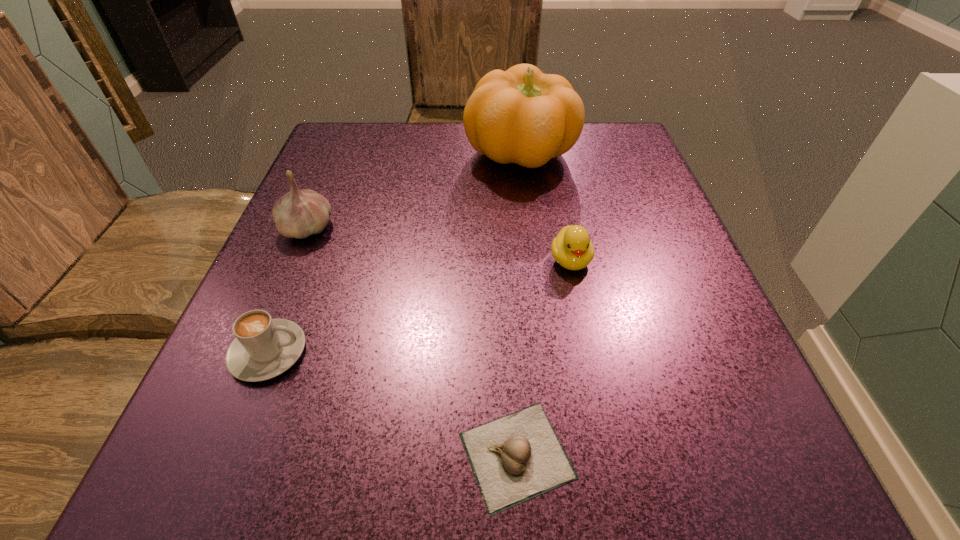
Image resolution: width=960 pixels, height=540 pixels. In order to click on empty space between the duckling and the right garlic in this screenshot , I will do `click(543, 357)`.

Where is `vacant area that lies between the farthest object and the second tallest object`? The width and height of the screenshot is (960, 540). vacant area that lies between the farthest object and the second tallest object is located at coordinates (414, 191).

Where is `unoccupied position between the second shortest object and the farthest object`? The width and height of the screenshot is (960, 540). unoccupied position between the second shortest object and the farthest object is located at coordinates (394, 254).

Image resolution: width=960 pixels, height=540 pixels. In order to click on unoccupied area between the second shortest object and the second tallest object in this screenshot , I will do `click(288, 290)`.

The height and width of the screenshot is (540, 960). In order to click on vacant area between the farther garlic and the duckling in this screenshot , I will do `click(439, 244)`.

Locate an element on the screen. The width and height of the screenshot is (960, 540). free space between the pumpkin and the fourth farthest object is located at coordinates (394, 254).

Identify which object is located as the second nearest to the fourth shortest object. Please provide its 2D coordinates. Your answer should be formatted as a tuple, i.e. [(x, y)], where the tuple contains the x and y coordinates of a point satisfying the conditions above.

[(523, 116)]

Locate which object is the third closest to the taller garlic. Please provide its 2D coordinates. Your answer should be formatted as a tuple, i.e. [(x, y)], where the tuple contains the x and y coordinates of a point satisfying the conditions above.

[(517, 457)]

Where is `free spot that satisfies the following two spatial constraints: 1. on the front side of the farthest object; 2. to the right of the cappuccino`? free spot that satisfies the following two spatial constraints: 1. on the front side of the farthest object; 2. to the right of the cappuccino is located at coordinates (543, 352).

At what (x,y) coordinates should I click in order to perform the action: click on vacant space that satisfies the following two spatial constraints: 1. on the back side of the nearer garlic; 2. on the left side of the tallest object. Please return your answer as a coordinate pair (x, y). This screenshot has height=540, width=960. Looking at the image, I should click on (499, 155).